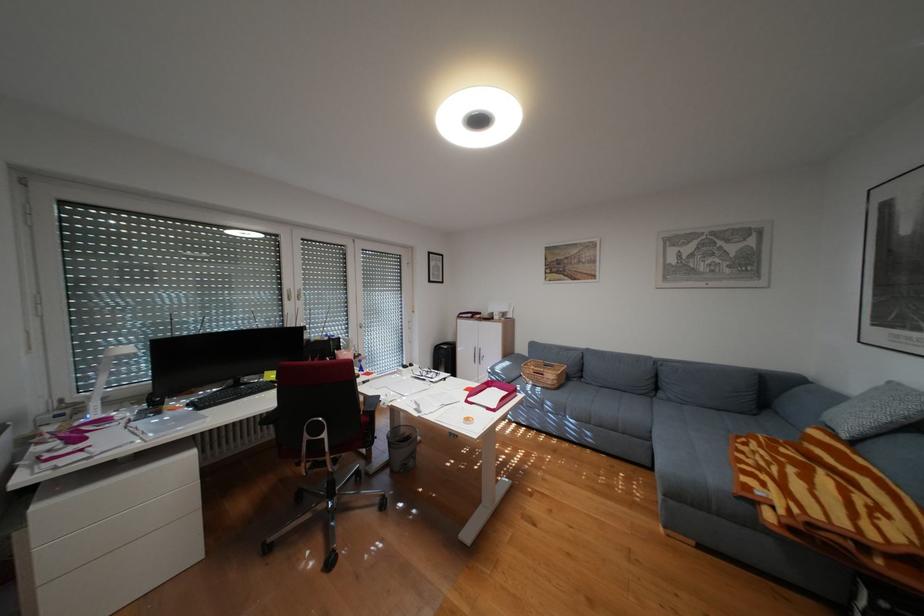
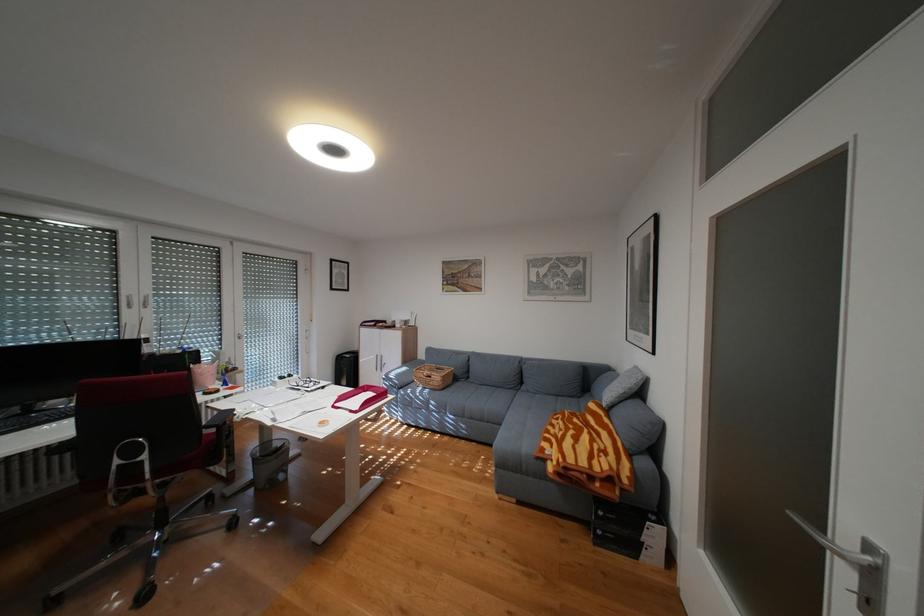
Where in the second image is the point corresponding to point 563,374 from the first image?

(450, 377)